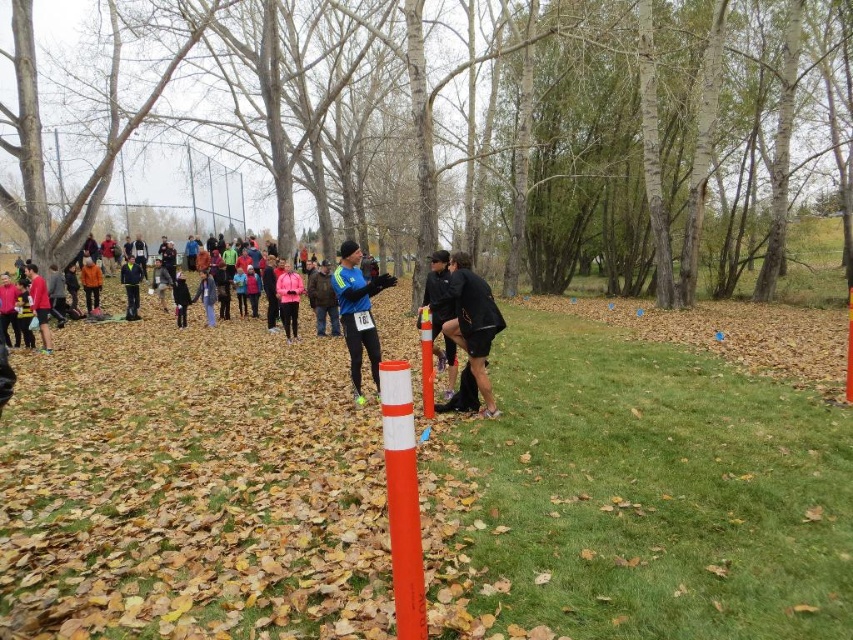
Question: Which of the following is the closest to the observer?

Choices:
 (A) (401, 580)
 (B) (479, 308)

Answer: (A)

Question: Which of these objects is positioned farthest from the matte pink jacket at center?

Choices:
 (A) black matte shorts at center
 (B) orange matte pole at center
 (C) blue synthetic jacket at center

Answer: (B)

Question: Can you confirm if black matte shorts at center is positioned above matte pink jacket at center?

Choices:
 (A) no
 (B) yes

Answer: (A)

Question: Does orange matte pole at center appear on the right side of blue synthetic jacket at center?

Choices:
 (A) yes
 (B) no

Answer: (A)

Question: Considering the relative positions of black matte shorts at center and blue synthetic jacket at center in the image provided, where is black matte shorts at center located with respect to blue synthetic jacket at center?

Choices:
 (A) below
 (B) above

Answer: (A)

Question: Which object is positioned closest to the orange matte pole at center?

Choices:
 (A) blue synthetic jacket at center
 (B) black matte shorts at center

Answer: (B)